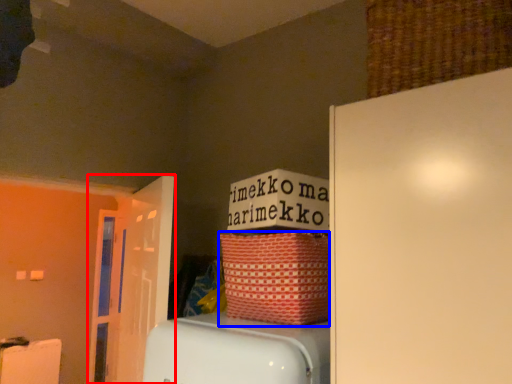
Question: Which object appears farthest to the camera in this image, door (highlighted by a red box) or basket (highlighted by a blue box)?

Choices:
 (A) door
 (B) basket

Answer: (A)